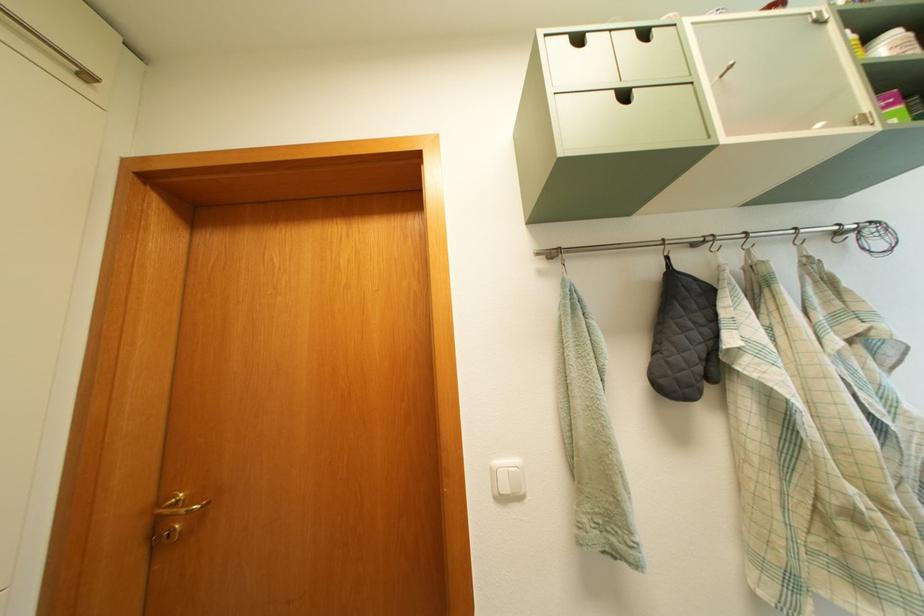
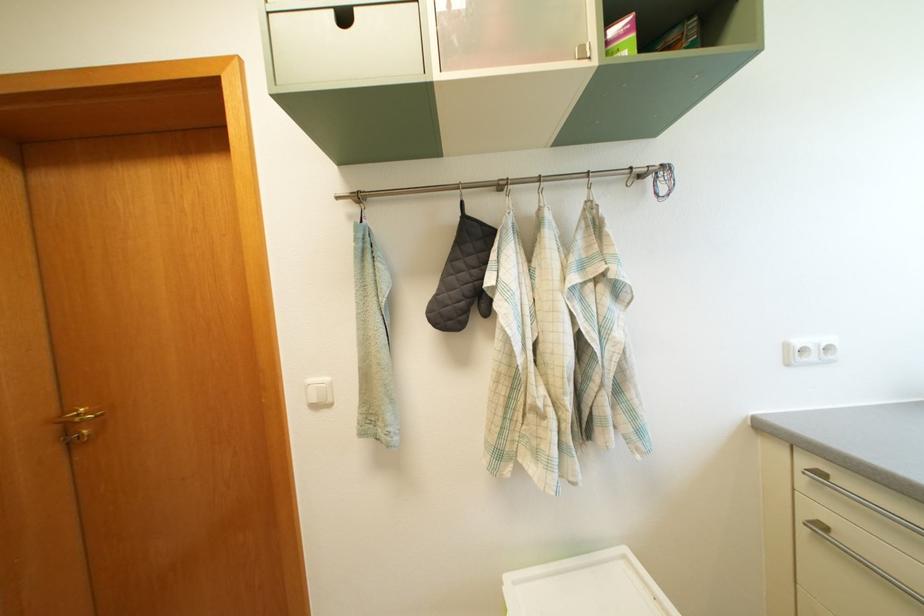
Locate, in the second image, the point that corresponds to (505,469) in the first image.

(318, 387)